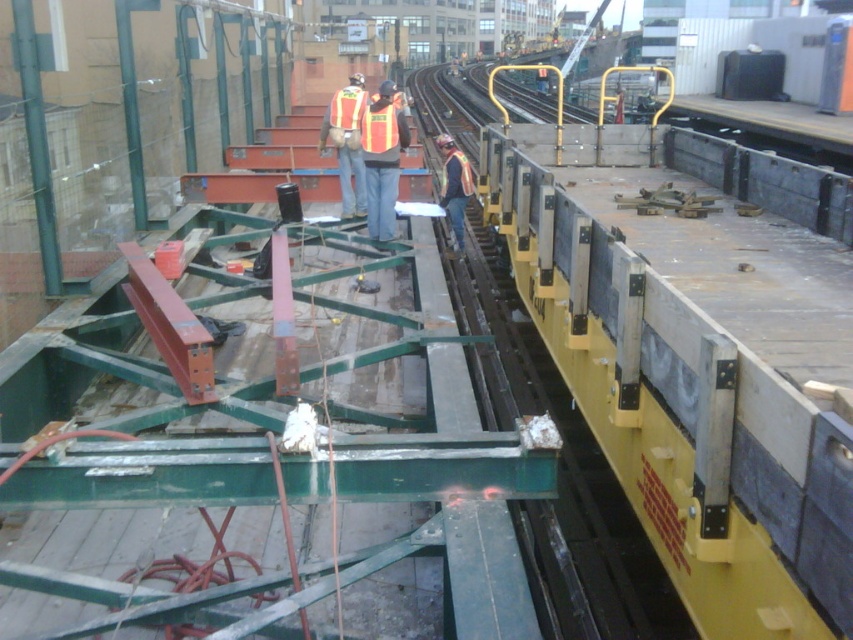
You are a safety inspector at the construction site. You need to ensure that the yellow painted steel train car at center and the reflective safety vest at center are visible from a distance. Which one is more likely to be seen first by someone approaching the site?

The yellow painted steel train car at center is larger in size than the reflective safety vest at center, so it will be more visible from a distance and seen first.

You are a safety inspector at the construction site. You need to ensure that workers maintain a safe distance of at least 3 meters apart for safety protocols. You see the reflective safety vest at center and the reflective fabric safety vest at center. Are the workers following the safety distance rule?

The distance between the reflective safety vest at center and the reflective fabric safety vest at center is 2.76 meters, which is less than the required 3 meters. Therefore, the workers are not following the safety distance rule.